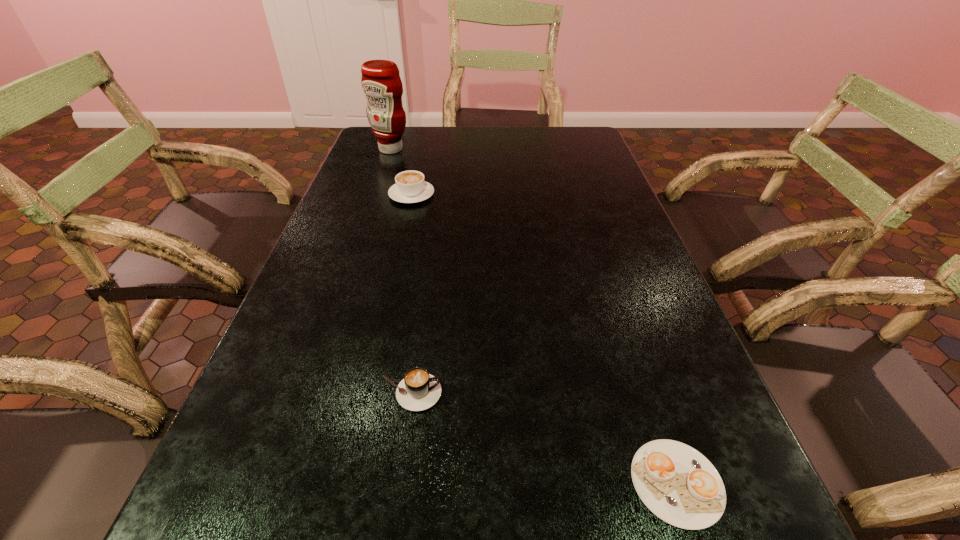
Identify the location of free space at the left edge. This screenshot has height=540, width=960. (311, 262).

Locate an element on the screen. vacant space at the right edge of the desktop is located at coordinates (608, 215).

Where is `vacant position at the far right corner of the desktop`? This screenshot has height=540, width=960. vacant position at the far right corner of the desktop is located at coordinates (565, 143).

At what (x,y) coordinates should I click in order to perform the action: click on vacant point located between the second tallest cappuccino and the farthest cappuccino. Please return your answer as a coordinate pair (x, y). This screenshot has height=540, width=960. Looking at the image, I should click on [411, 294].

Where is `free space that is in between the tallest object and the second shortest cappuccino`? Image resolution: width=960 pixels, height=540 pixels. free space that is in between the tallest object and the second shortest cappuccino is located at coordinates (400, 271).

In order to click on unoccupied position between the nearest cappuccino and the second farthest object in this screenshot , I will do point(544,339).

You are a GUI agent. You are given a task and a screenshot of the screen. Output one action in this format:
    pyautogui.click(x=<x>, y=<y>)
    Task: Click on the vacant area that lies between the tallest cappuccino and the third tallest object
    
    Given the screenshot: What is the action you would take?
    pyautogui.click(x=411, y=294)

Identify the location of blank region between the third nearest object and the second nearest cappuccino. (411, 294).

This screenshot has height=540, width=960. Identify the location of unoccupied position between the nearest object and the second tallest object. (544, 339).

You are a GUI agent. You are given a task and a screenshot of the screen. Output one action in this format:
    pyautogui.click(x=<x>, y=<y>)
    Task: Click on the empty space between the rightmost object and the farthest object
    Image resolution: width=960 pixels, height=540 pixels.
    Given the screenshot: What is the action you would take?
    pyautogui.click(x=534, y=316)